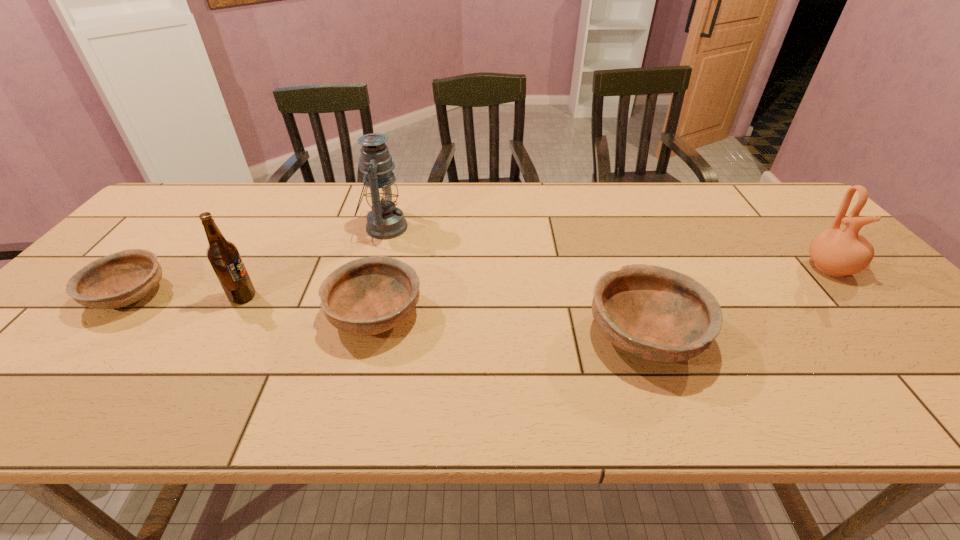
The image size is (960, 540). In order to click on vacant space at the left edge of the desktop in this screenshot , I will do click(x=56, y=327).

Find the location of a particular element. This screenshot has height=540, width=960. free space between the second shortest bowl and the fifth object from right to left is located at coordinates (309, 306).

Locate an element on the screen. Image resolution: width=960 pixels, height=540 pixels. vacant point located between the fifth object from right to left and the farthest object is located at coordinates (314, 262).

Find the location of a particular element. The height and width of the screenshot is (540, 960). empty space that is in between the leftmost object and the fifth object from right to left is located at coordinates (186, 296).

Where is `empty space that is in between the fifth object from left to right and the second bowl from right to left`? This screenshot has width=960, height=540. empty space that is in between the fifth object from left to right and the second bowl from right to left is located at coordinates (510, 325).

This screenshot has height=540, width=960. I want to click on vacant area between the beer bottle and the second object from right to left, so click(x=444, y=316).

Where is `empty location between the lantern and the second object from left to right`? The width and height of the screenshot is (960, 540). empty location between the lantern and the second object from left to right is located at coordinates (314, 262).

Locate an element on the screen. blank region between the pottery and the lantern is located at coordinates (607, 248).

Find the location of a particular element. Image resolution: width=960 pixels, height=540 pixels. free space between the pottery and the leftmost object is located at coordinates (479, 282).

Choose which object is the third nearest neighbor to the beer bottle. Please provide its 2D coordinates. Your answer should be formatted as a tuple, i.e. [(x, y)], where the tuple contains the x and y coordinates of a point satisfying the conditions above.

[(385, 221)]